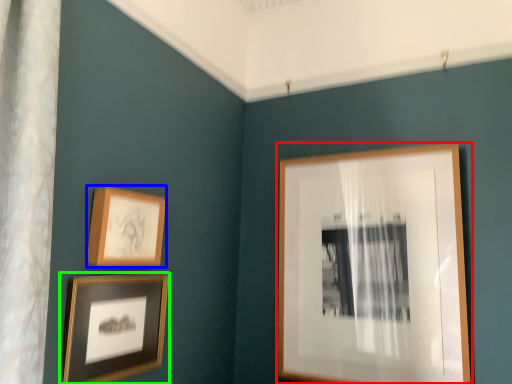
Question: Which object is positioned closest to picture frame (highlighted by a red box)? Select from picture frame (highlighted by a blue box) and picture frame (highlighted by a green box).

Choices:
 (A) picture frame
 (B) picture frame

Answer: (B)